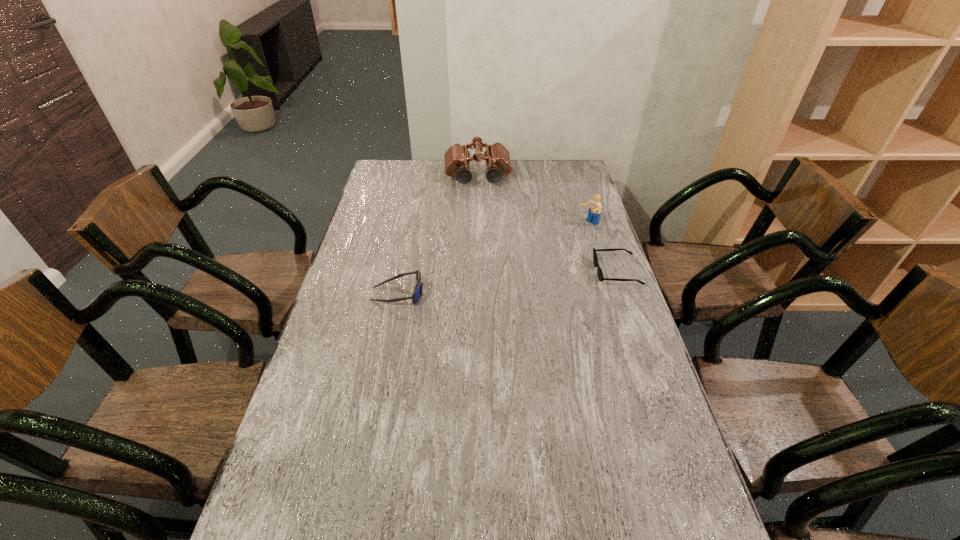
Where is `vacant area situated on the front-facing side of the shortest object`? Image resolution: width=960 pixels, height=540 pixels. vacant area situated on the front-facing side of the shortest object is located at coordinates (566, 272).

I want to click on vacant space situated 0.100m on the front-facing side of the shortest object, so click(x=566, y=272).

Locate an element on the screen. The image size is (960, 540). free space located through the eyepieces of the binoculars is located at coordinates (483, 234).

Where is `vacant space situated through the eyepieces of the binoculars`? This screenshot has height=540, width=960. vacant space situated through the eyepieces of the binoculars is located at coordinates (481, 214).

This screenshot has height=540, width=960. Find the location of `vacant space located through the eyepieces of the binoculars`. vacant space located through the eyepieces of the binoculars is located at coordinates (482, 221).

Locate an element on the screen. vacant region located on the face of the third nearest object is located at coordinates (520, 263).

Where is `vacant region located 0.100m on the face of the third nearest object`? vacant region located 0.100m on the face of the third nearest object is located at coordinates (564, 238).

You are a GUI agent. You are given a task and a screenshot of the screen. Output one action in this format:
    pyautogui.click(x=<x>, y=<y>)
    Task: Click on the vacant region located on the face of the third nearest object
    This screenshot has height=540, width=960.
    Given the screenshot: What is the action you would take?
    pyautogui.click(x=527, y=260)

Locate an element on the screen. This screenshot has width=960, height=540. object present at the far edge is located at coordinates (457, 158).

At what (x,y) coordinates should I click in order to perform the action: click on object located at the left edge. Please return your answer as a coordinate pair (x, y). This screenshot has height=540, width=960. Looking at the image, I should click on (416, 295).